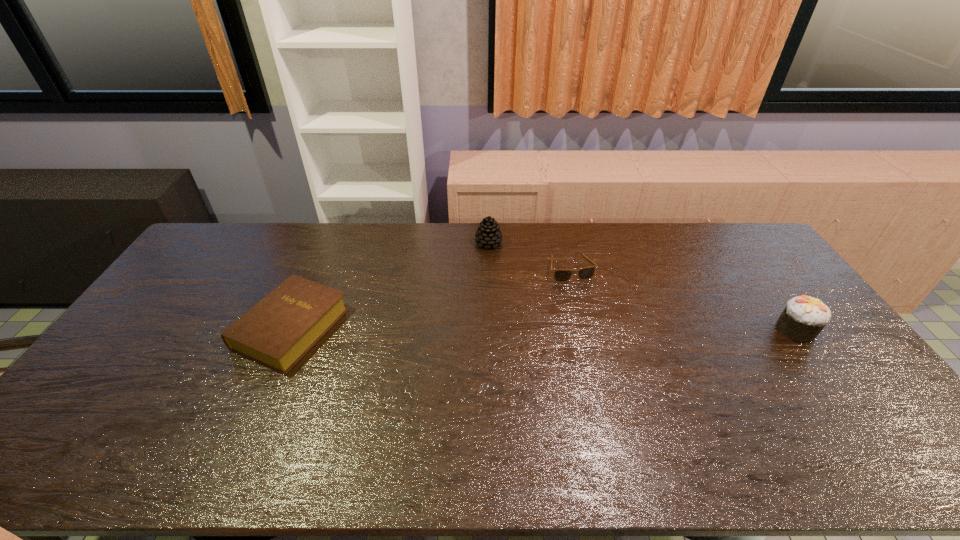
The height and width of the screenshot is (540, 960). In order to click on free space located 0.150m at the narrow end of the pinecone in this screenshot , I will do `click(518, 273)`.

Where is `vacant space located 0.370m at the narrow end of the pinecone`? The width and height of the screenshot is (960, 540). vacant space located 0.370m at the narrow end of the pinecone is located at coordinates (558, 313).

You are a GUI agent. You are given a task and a screenshot of the screen. Output one action in this format:
    pyautogui.click(x=<x>, y=<y>)
    Task: Click on the free spot located 0.090m on the frames of the second object from right to left
    
    Given the screenshot: What is the action you would take?
    pyautogui.click(x=586, y=301)

I want to click on vacant region located 0.110m on the frames of the second object from right to left, so click(x=588, y=306).

This screenshot has width=960, height=540. What are the coordinates of `vacant space situated on the frames of the second object from right to left` in the screenshot? It's located at (619, 372).

This screenshot has width=960, height=540. Find the location of `pinecone that is at the far edge`. pinecone that is at the far edge is located at coordinates (488, 233).

The image size is (960, 540). Identify the location of sunglasses situated at the far edge. (560, 275).

Image resolution: width=960 pixels, height=540 pixels. What are the coordinates of `object positioned at the right edge` in the screenshot? It's located at (804, 317).

Where is `free location at the far edge of the desktop`? The height and width of the screenshot is (540, 960). free location at the far edge of the desktop is located at coordinates (506, 230).

The width and height of the screenshot is (960, 540). Identify the location of free spot at the near edge of the desktop. (712, 404).